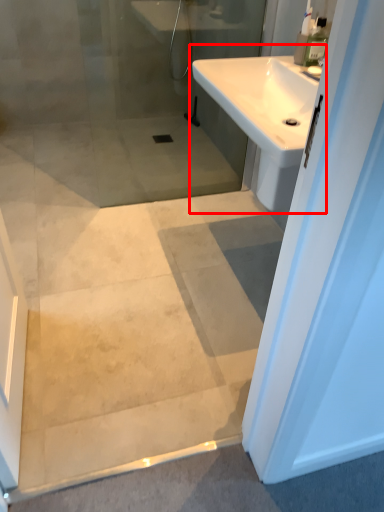
Question: Observing the image, what is the correct spatial positioning of sink (annotated by the red box) in reference to toiletry?

Choices:
 (A) right
 (B) left

Answer: (B)